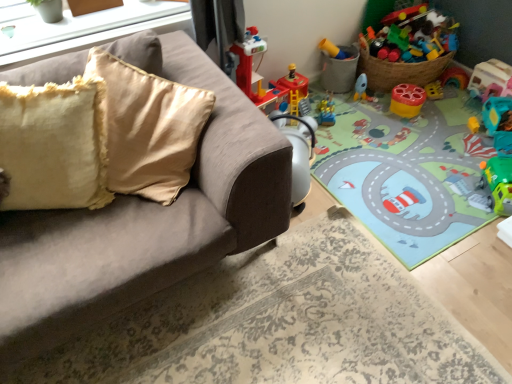
Question: Is yellow plastic cup at center-right, the 3th toy from the left, further to camera compared to matte plastic bucket at upper right, which is the 2th toy from left to right?

Choices:
 (A) yes
 (B) no

Answer: (B)

Question: Is yellow plastic cup at center-right, acting as the 4th toy starting from the right, to the right of matte plastic bucket at upper right, which ranks as the fifth toy in right-to-left order, from the viewer's perspective?

Choices:
 (A) yes
 (B) no

Answer: (A)

Question: Can you confirm if yellow plastic cup at center-right, acting as the 4th toy starting from the right, is bigger than matte plastic bucket at upper right, which is the 2th toy from left to right?

Choices:
 (A) yes
 (B) no

Answer: (B)

Question: Is yellow plastic cup at center-right, the 3th toy from the left, aimed at matte plastic bucket at upper right, which is the 2th toy from left to right?

Choices:
 (A) no
 (B) yes

Answer: (A)

Question: Is matte plastic bucket at upper right, which ranks as the fifth toy in right-to-left order, located within yellow plastic cup at center-right, the 3th toy from the left?

Choices:
 (A) yes
 (B) no

Answer: (B)

Question: Considering the relative sizes of yellow plastic cup at center-right, the 3th toy from the left, and matte plastic bucket at upper right, which ranks as the fifth toy in right-to-left order, in the image provided, is yellow plastic cup at center-right, the 3th toy from the left, shorter than matte plastic bucket at upper right, which ranks as the fifth toy in right-to-left order,?

Choices:
 (A) no
 (B) yes

Answer: (B)

Question: Is suede-like gray couch at upper left to the right of rubber duck at lower right, marked as the fifth toy in a left-to-right arrangement, from the viewer's perspective?

Choices:
 (A) no
 (B) yes

Answer: (A)

Question: Can you confirm if suede-like gray couch at upper left is positioned to the left of rubber duck at lower right, placed as the 2th toy when sorted from right to left?

Choices:
 (A) yes
 (B) no

Answer: (A)

Question: From the image's perspective, is suede-like gray couch at upper left located beneath rubber duck at lower right, placed as the 2th toy when sorted from right to left?

Choices:
 (A) no
 (B) yes

Answer: (B)

Question: Is suede-like gray couch at upper left far from rubber duck at lower right, placed as the 2th toy when sorted from right to left?

Choices:
 (A) no
 (B) yes

Answer: (B)

Question: Is suede-like gray couch at upper left looking in the opposite direction of rubber duck at lower right, marked as the fifth toy in a left-to-right arrangement?

Choices:
 (A) yes
 (B) no

Answer: (B)

Question: Considering the relative sizes of suede-like gray couch at upper left and rubber duck at lower right, placed as the 2th toy when sorted from right to left, in the image provided, is suede-like gray couch at upper left smaller than rubber duck at lower right, placed as the 2th toy when sorted from right to left,?

Choices:
 (A) no
 (B) yes

Answer: (A)

Question: Can you confirm if matte plastic bucket at upper right, which is the 2th toy from left to right, is positioned to the right of matte white window sill at upper left?

Choices:
 (A) no
 (B) yes

Answer: (B)